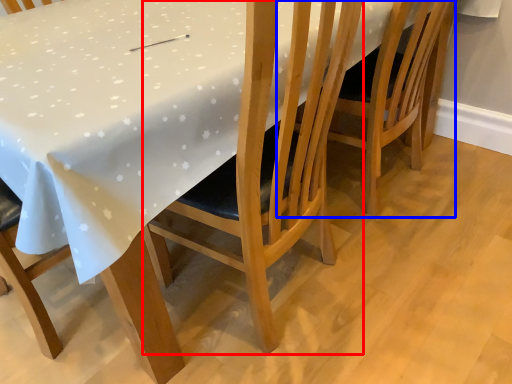
Question: Which object is further to the camera taking this photo, chair (highlighted by a red box) or chair (highlighted by a blue box)?

Choices:
 (A) chair
 (B) chair

Answer: (B)